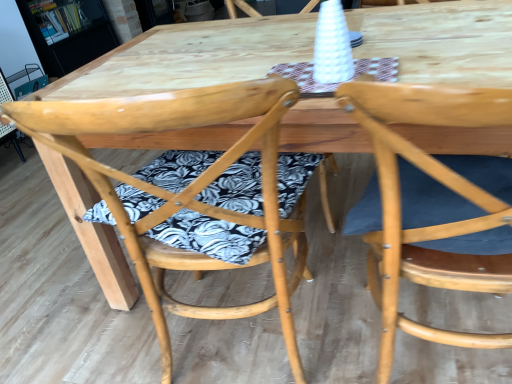
Question: Does wooden bookshelf at upper left have a greater height compared to natural wood chair at center, placed as the first chair when sorted from left to right?

Choices:
 (A) yes
 (B) no

Answer: (B)

Question: From a real-world perspective, is wooden bookshelf at upper left positioned over natural wood chair at center, placed as the first chair when sorted from left to right, based on gravity?

Choices:
 (A) no
 (B) yes

Answer: (B)

Question: Can you confirm if wooden bookshelf at upper left is thinner than natural wood chair at center, the 2th chair viewed from the right?

Choices:
 (A) no
 (B) yes

Answer: (B)

Question: Is wooden bookshelf at upper left looking in the opposite direction of natural wood chair at center, the 2th chair viewed from the right?

Choices:
 (A) no
 (B) yes

Answer: (A)

Question: Is wooden bookshelf at upper left oriented towards natural wood chair at center, placed as the first chair when sorted from left to right?

Choices:
 (A) yes
 (B) no

Answer: (B)

Question: Is wooden bookshelf at upper left positioned beyond the bounds of natural wood chair at center, the 2th chair viewed from the right?

Choices:
 (A) yes
 (B) no

Answer: (A)

Question: Is natural wood chair at center, the 2th chair viewed from the right, positioned with its back to natural wood chair at right, acting as the first chair starting from the right?

Choices:
 (A) yes
 (B) no

Answer: (B)

Question: Is natural wood chair at center, the 2th chair viewed from the right, facing towards natural wood chair at right, marked as the second chair in a left-to-right arrangement?

Choices:
 (A) no
 (B) yes

Answer: (A)

Question: Is natural wood chair at center, the 2th chair viewed from the right, not close to natural wood chair at right, marked as the second chair in a left-to-right arrangement?

Choices:
 (A) no
 (B) yes

Answer: (A)

Question: Is natural wood chair at center, placed as the first chair when sorted from left to right, closer to camera compared to natural wood chair at right, acting as the first chair starting from the right?

Choices:
 (A) yes
 (B) no

Answer: (B)

Question: Does natural wood chair at center, the 2th chair viewed from the right, have a greater height compared to natural wood chair at right, marked as the second chair in a left-to-right arrangement?

Choices:
 (A) yes
 (B) no

Answer: (A)

Question: Can you confirm if natural wood chair at center, placed as the first chair when sorted from left to right, is smaller than natural wood chair at right, marked as the second chair in a left-to-right arrangement?

Choices:
 (A) yes
 (B) no

Answer: (B)

Question: Considering the relative sizes of natural wood chair at right, acting as the first chair starting from the right, and natural wood chair at center, the 2th chair viewed from the right, in the image provided, is natural wood chair at right, acting as the first chair starting from the right, bigger than natural wood chair at center, the 2th chair viewed from the right,?

Choices:
 (A) no
 (B) yes

Answer: (A)